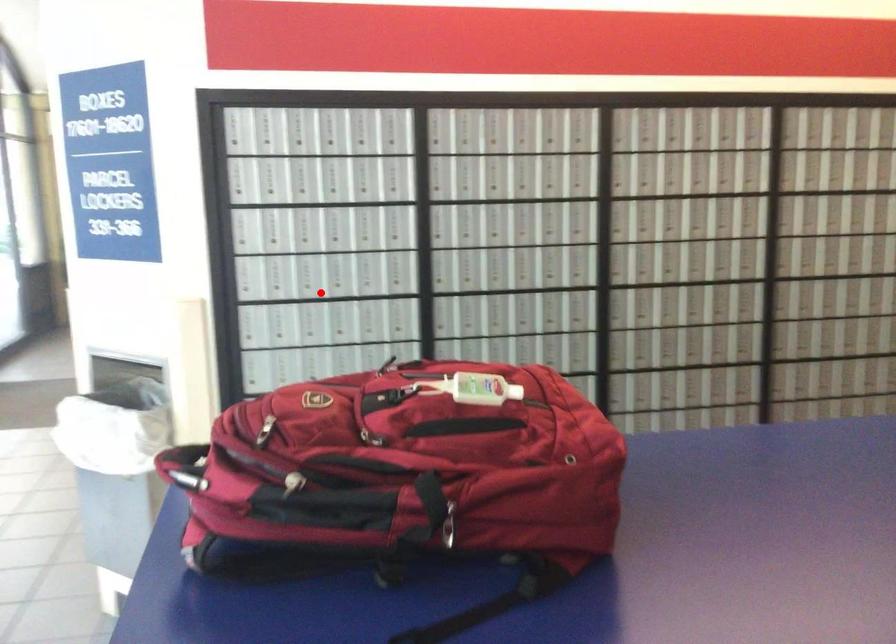
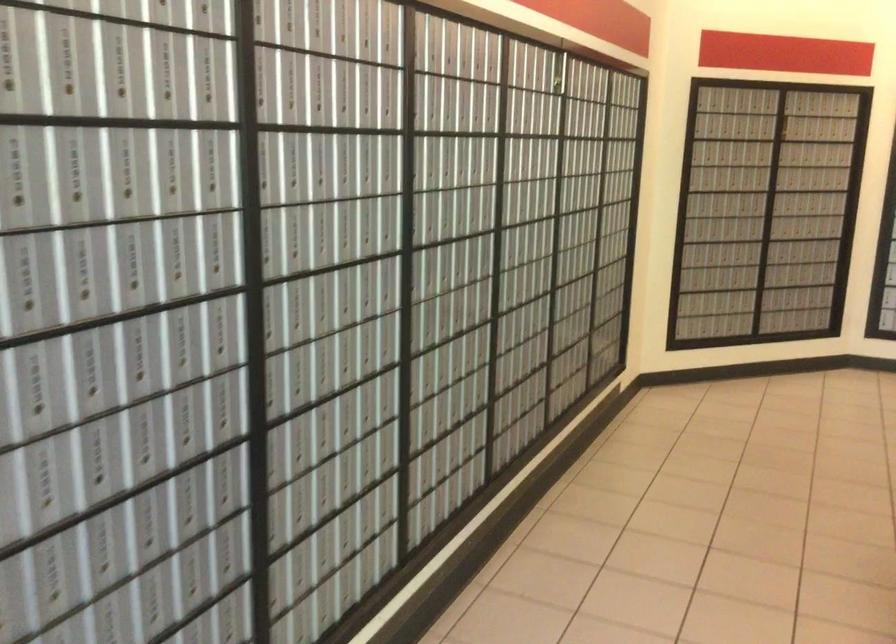
Question: I am providing you with two images of the same scene from different viewpoints. Given a red point in image1, look at the same physical point in image2. Is it:

Choices:
 (A) Closer to the viewpoint
 (B) Farther from the viewpoint

Answer: (A)